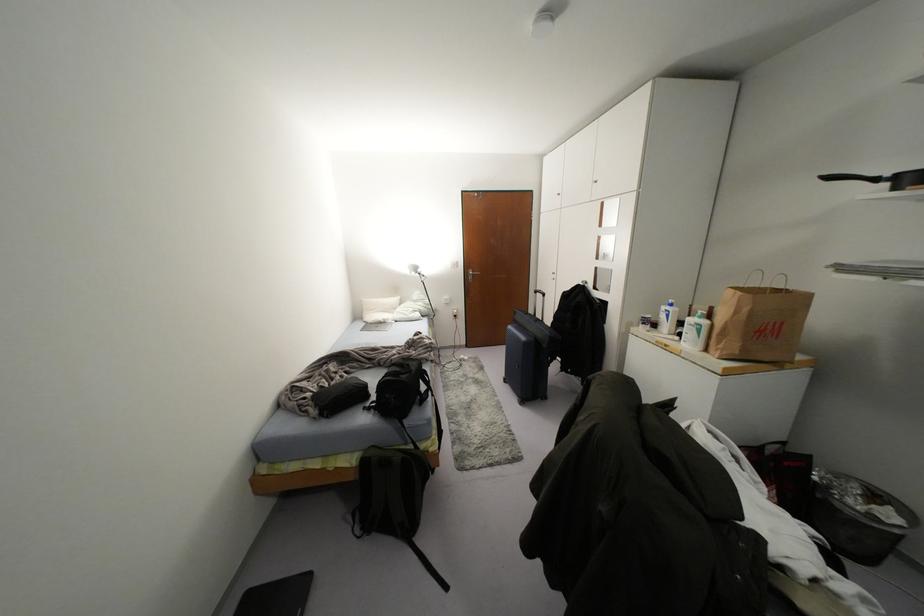
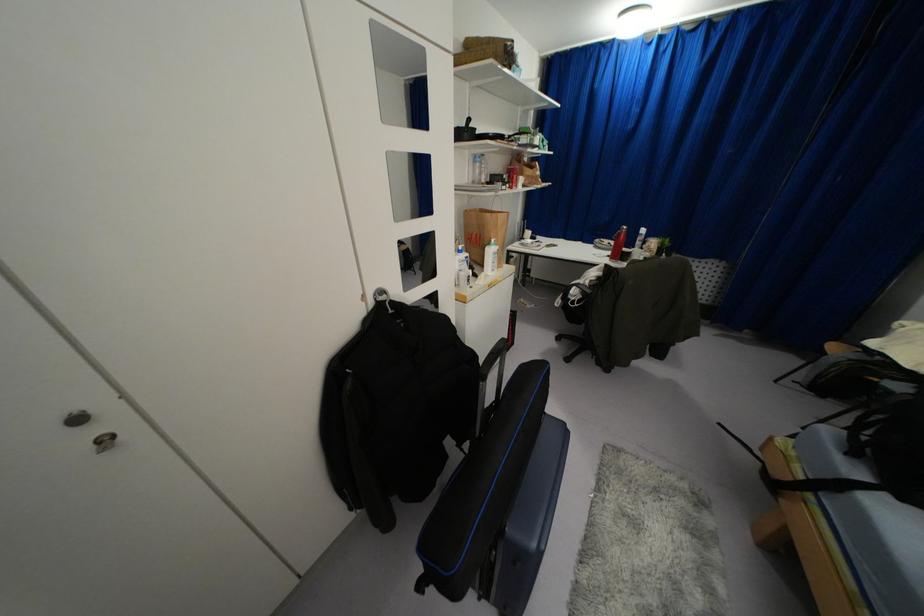
Question: I am providing you with two images of the same scene from different viewpoints. Please identify which objects are invisible in image2.

Choices:
 (A) red water bottle
 (B) white bottle pump
 (C) chair sitting surface
 (D) none of these

Answer: (D)